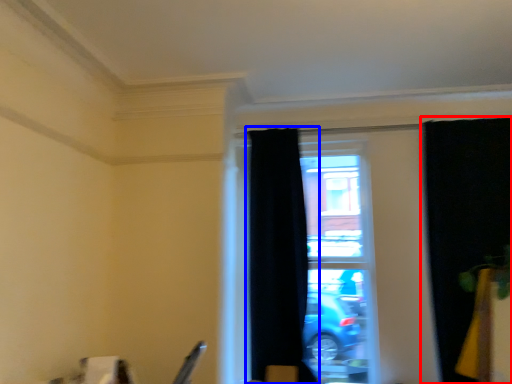
Question: Which object appears closest to the camera in this image, curtain (highlighted by a red box) or curtain (highlighted by a blue box)?

Choices:
 (A) curtain
 (B) curtain

Answer: (A)